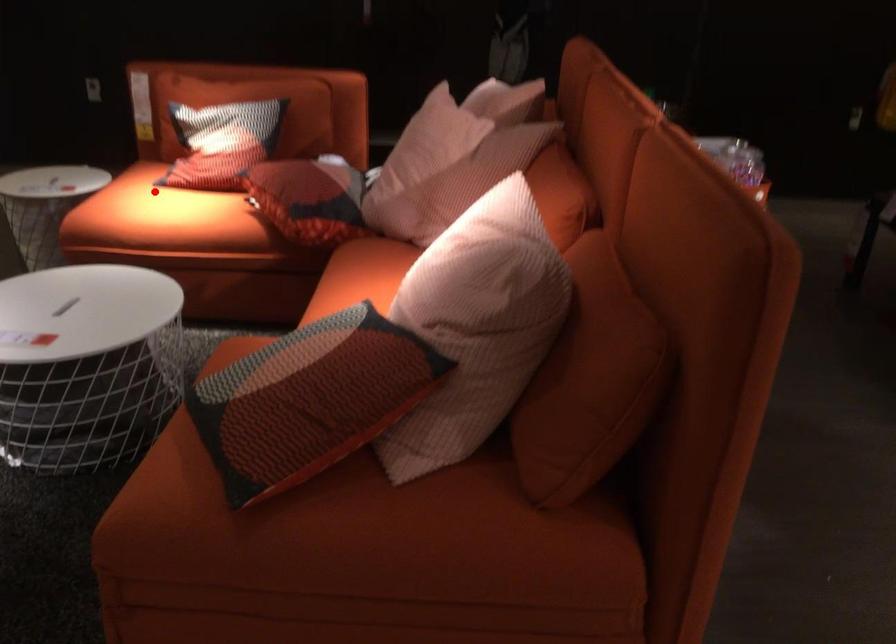
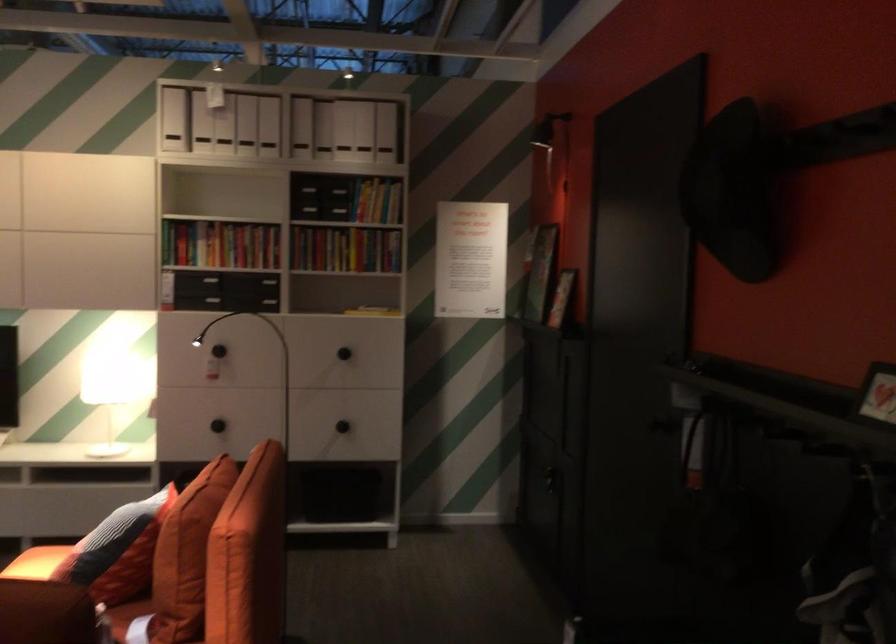
Question: I am providing you with two images of the same scene from different viewpoints. Image1 has a red point marked. In image2, the corresponding 3D location appears at what relative position? Reply with the corresponding letter.

Choices:
 (A) Closer
 (B) Farther

Answer: (A)